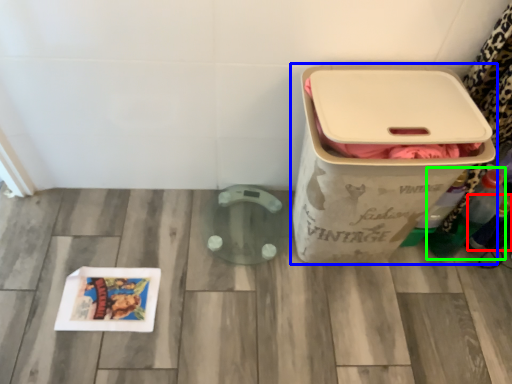
Question: Based on their relative distances, which object is farther from bottle (highlighted by a red box)? Choose from waste container (highlighted by a blue box) and bottle (highlighted by a green box).

Choices:
 (A) waste container
 (B) bottle

Answer: (A)